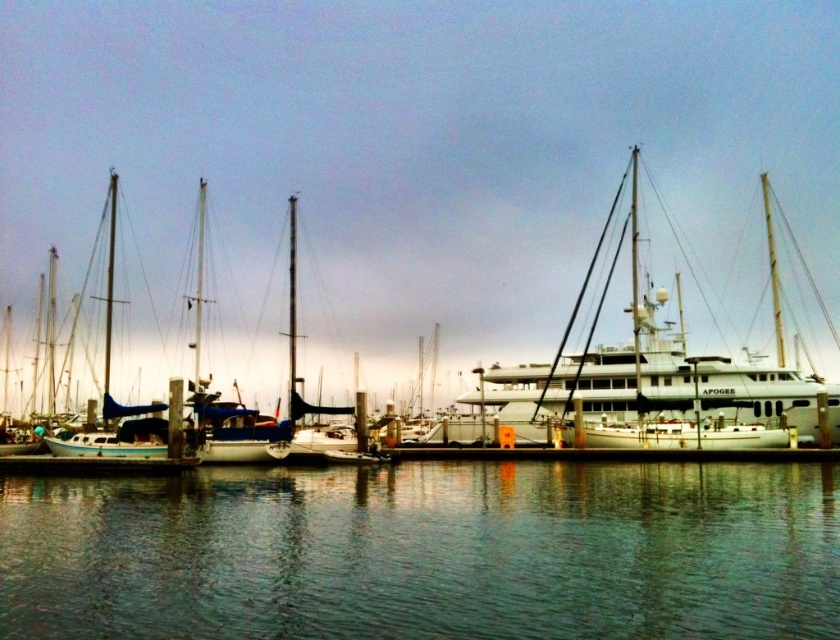
Question: Is green reflective water at lower center closer to the viewer compared to white glossy yacht at center?

Choices:
 (A) yes
 (B) no

Answer: (A)

Question: Is green reflective water at lower center positioned in front of white glossy yacht at center?

Choices:
 (A) yes
 (B) no

Answer: (A)

Question: Among these objects, which one is nearest to the camera?

Choices:
 (A) green reflective water at lower center
 (B) white glossy yacht at center

Answer: (A)

Question: Does green reflective water at lower center lie in front of white glossy yacht at center?

Choices:
 (A) no
 (B) yes

Answer: (B)

Question: Which point is farther from the camera taking this photo?

Choices:
 (A) (584, 586)
 (B) (547, 392)

Answer: (B)